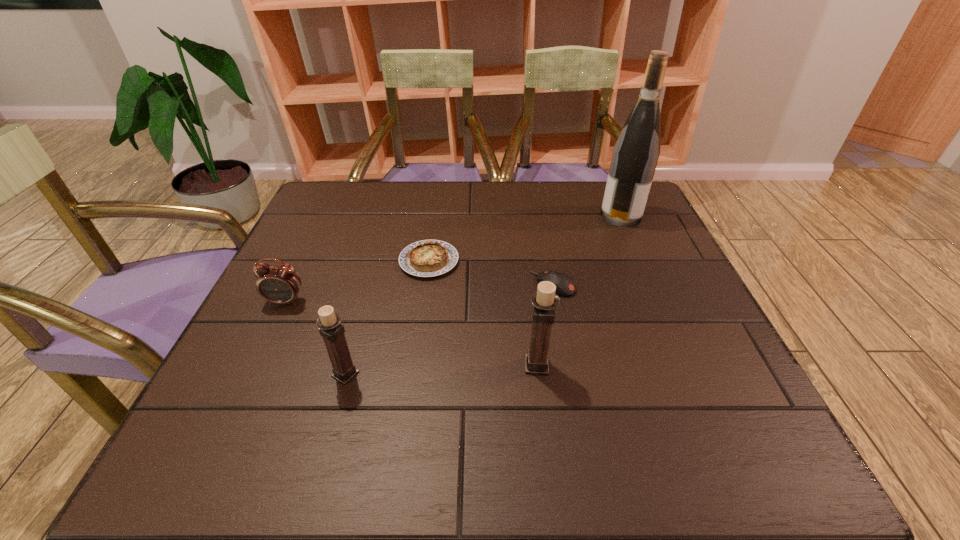
Where is `free spot that satisfies the following two spatial constraints: 1. on the front side of the computer mouse; 2. on the left side of the quiche`? Image resolution: width=960 pixels, height=540 pixels. free spot that satisfies the following two spatial constraints: 1. on the front side of the computer mouse; 2. on the left side of the quiche is located at coordinates (426, 284).

What are the coordinates of `vacant space that satisfies the following two spatial constraints: 1. on the back side of the fifth object from right to left; 2. on the left side of the taller candle holder` in the screenshot? It's located at (348, 365).

Where is `free location that satisfies the following two spatial constraints: 1. on the back side of the quiche; 2. on the right side of the third tallest object`? free location that satisfies the following two spatial constraints: 1. on the back side of the quiche; 2. on the right side of the third tallest object is located at coordinates (377, 261).